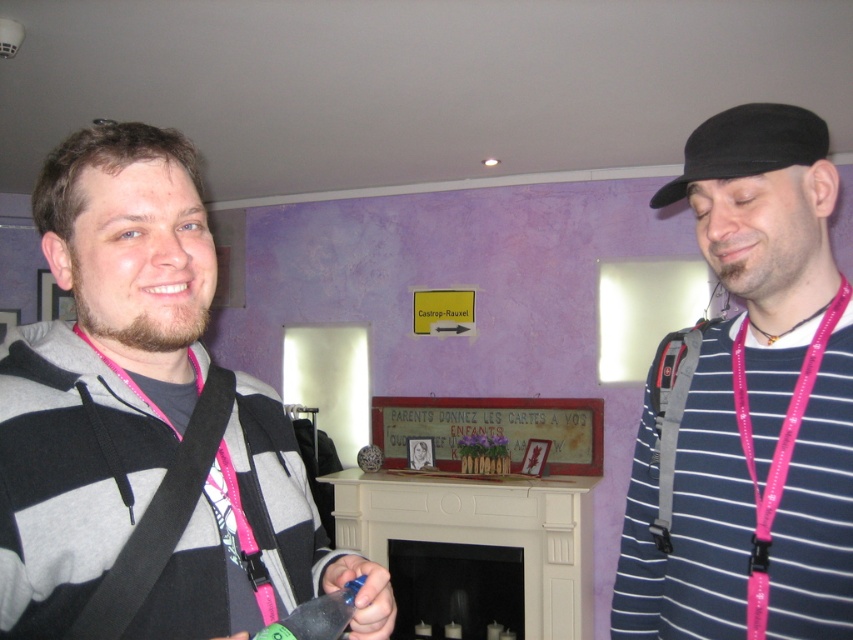
Question: Where is pink lanyard at center located in relation to black felt baseball cap at right in the image?

Choices:
 (A) left
 (B) right

Answer: (B)

Question: Does striped cotton shirt at right appear under black fabric strap at left?

Choices:
 (A) no
 (B) yes

Answer: (A)

Question: Which object is positioned farthest from the black felt baseball cap at right?

Choices:
 (A) pink glossy lanyard at right
 (B) gray hoodie at center

Answer: (B)

Question: Which of the following is the farthest from the observer?

Choices:
 (A) striped cotton shirt at right
 (B) gray hoodie at center

Answer: (A)

Question: Is black fabric strap at left closer to camera compared to pink lanyard at center?

Choices:
 (A) yes
 (B) no

Answer: (A)

Question: Estimate the real-world distances between objects in this image. Which object is closer to the pink lanyard at center?

Choices:
 (A) pink glossy lanyard at right
 (B) striped cotton shirt at right
 (C) gray hoodie at center

Answer: (A)